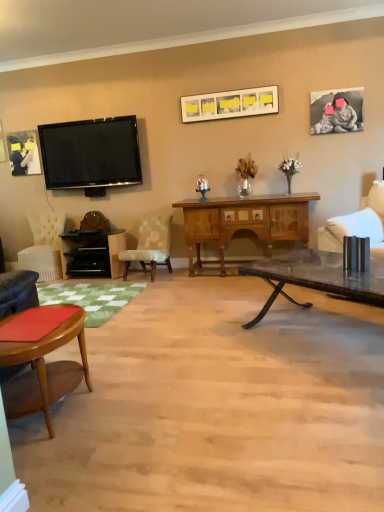
This screenshot has width=384, height=512. What are the coordinates of `free space to the left of transparent glass coffee table at center` in the screenshot? It's located at (219, 355).